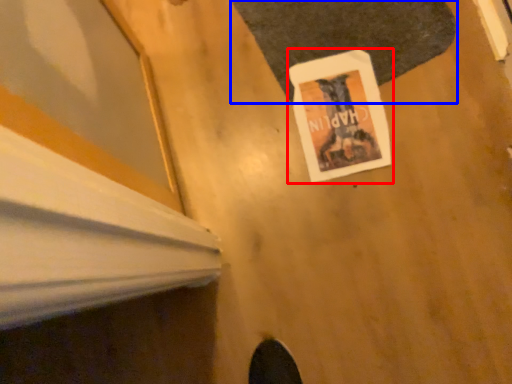
Question: Which point is closer to the camera, poster page (highlighted by a red box) or mat (highlighted by a blue box)?

Choices:
 (A) poster page
 (B) mat

Answer: (B)